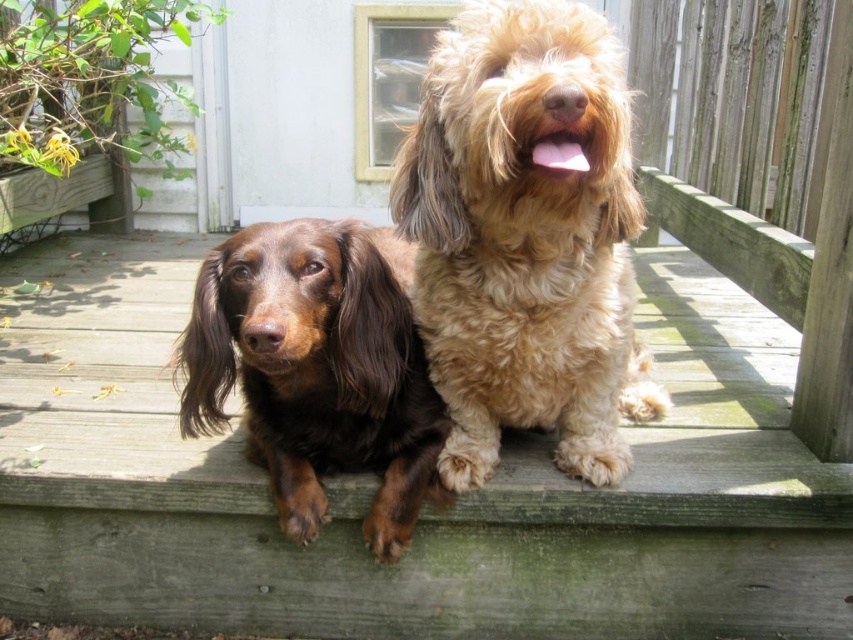
You are standing at the point marked as point [543,541] and want to take a photo of the two dogs on the wooden deck. The camera you have can focus on objects up to 2 meters away. Will the camera be able to capture a clear image of the dogs?

The distance between point [543,541] and the camera is 1.56 meters, which is within the camera focus range of 2 meters. Therefore, the camera can capture a clear image of the dogs.

You are standing on the wooden deck at center and want to throw a ball to the golden fluffy dog at center. In which direction should you throw the ball to reach the dog?

The wooden deck at center is positioned on the left side of the golden fluffy dog at center, so you should throw the ball to the right to reach the dog.